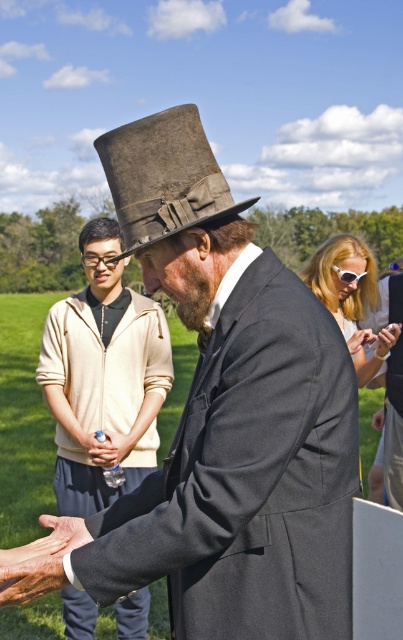
You are a photographer setting up a shoot in the park. You have two props to place in the scene described. The dry skin at lower left and the white plastic goggles at center. Since you want to ensure that the larger prop is placed in a position that draws attention, which prop should you place where?

The dry skin at lower left is bigger than the white plastic goggles at center, so you should place the dry skin at lower left in a prominent position to draw attention.

In the scene shown: You are a tailor who needs to determine which item requires more fabric for alterations. Given the light beige hoodie at center and the dry skin at lower left, which one has a greater width?

The light beige hoodie at center has a greater width than the dry skin at lower left, so it requires more fabric for alterations.